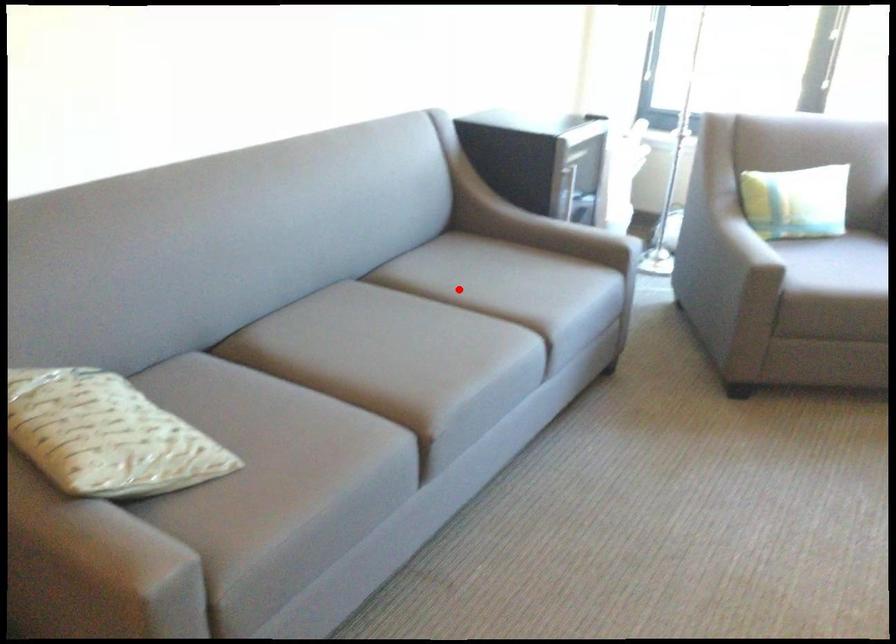
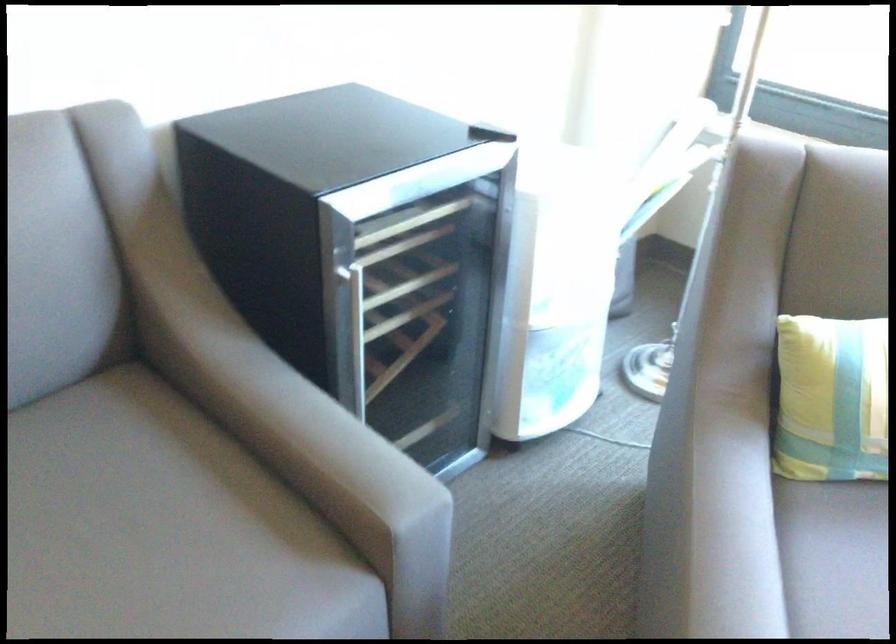
In the second image, find the point that corresponds to the highlighted location in the first image.

(83, 529)